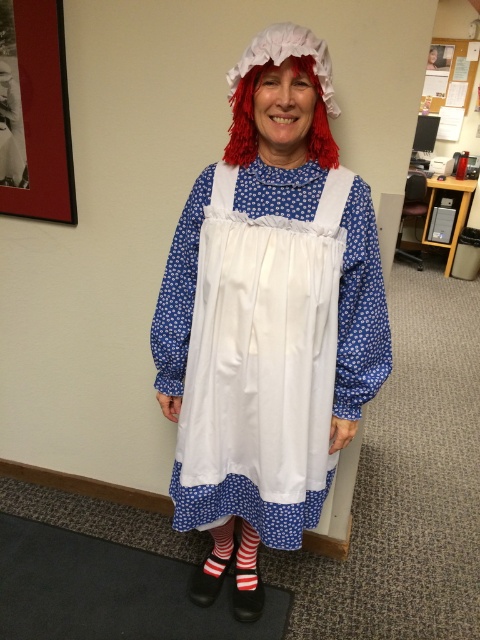
You are organizing a costume party and need to arrange the white cotton dress at center and the red fluffy wig at center on a display stand. Based on the image, which item should you place to the left of the other to accurately represent their original positions?

The white cotton dress at center should be placed to the left of the red fluffy wig at center because the white cotton dress at center is positioned on the left side of red fluffy wig at center in the original image.

You are standing at the point closest to the desk in the office. There are two points marked in the image, one at point (x=284, y=547) and the other at point (x=300, y=60). Which point is farther away from you?

Point (x=284, y=547) is behind point (x=300, y=60), so it is farther away from you.

You are an interior designer working on a layout for an office space. You need to place a white cotton dress at center in the room. Where should you position it?

The white cotton dress at center should be positioned at point (267, 316) as specified in the description.